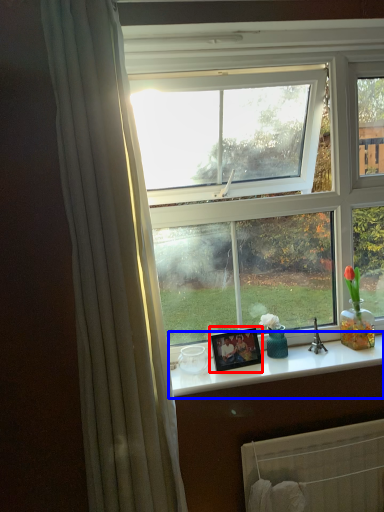
Question: Among these objects, which one is farthest to the camera, picture frame (highlighted by a red box) or counter top (highlighted by a blue box)?

Choices:
 (A) picture frame
 (B) counter top

Answer: (A)